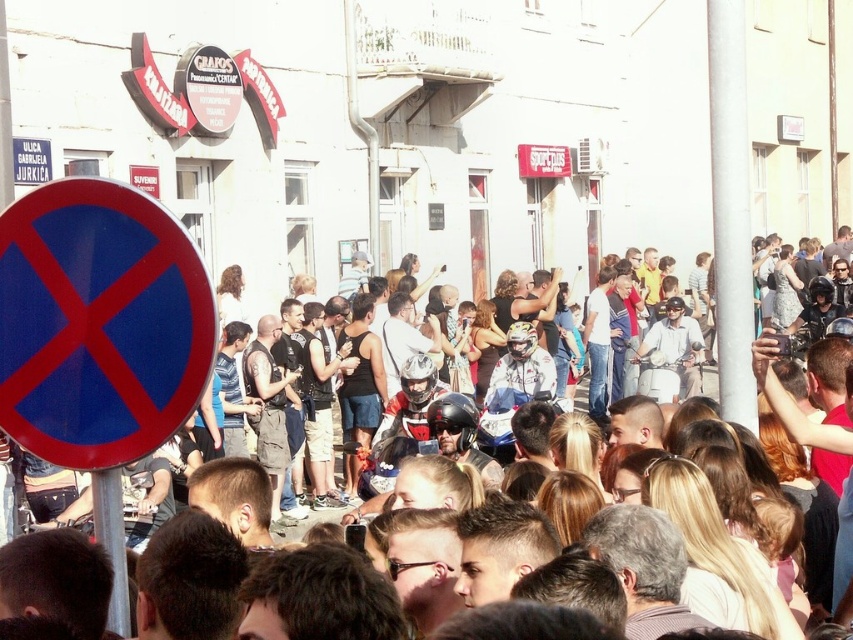
Between point (727, 113) and point (44, 156), which one is positioned in front?

Point (727, 113)

Who is positioned more to the left, silver metallic pole at upper right or blue circular sign at left?

Positioned to the left is blue circular sign at left.

Which is behind, point (718, 372) or point (21, 180)?

Positioned behind is point (718, 372).

The image size is (853, 640). What are the coordinates of `silver metallic pole at upper right` in the screenshot? It's located at (730, 209).

Measure the distance from blue glossy sign at left to blue circular sign at left.

blue glossy sign at left is 57.31 feet away from blue circular sign at left.

Does point (136, 308) come in front of point (19, 160)?

Yes, it is in front of point (19, 160).

Which is behind, point (33, 369) or point (12, 157)?

Point (12, 157)

Locate an element on the screen. The height and width of the screenshot is (640, 853). blue glossy sign at left is located at coordinates (99, 323).

Looking at this image, is blue glossy sign at left above silver metallic pole at upper right?

Actually, blue glossy sign at left is below silver metallic pole at upper right.

Which is below, blue glossy sign at left or silver metallic pole at upper right?

blue glossy sign at left

Measure the distance between blue glossy sign at left and camera.

31.43 meters

What are the coordinates of `blue glossy sign at left` in the screenshot? It's located at (99, 323).